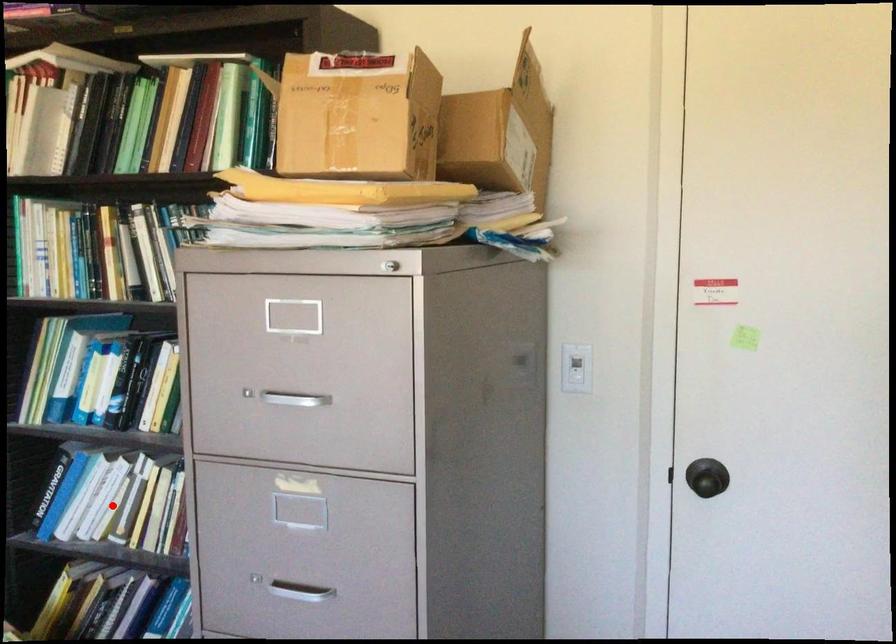
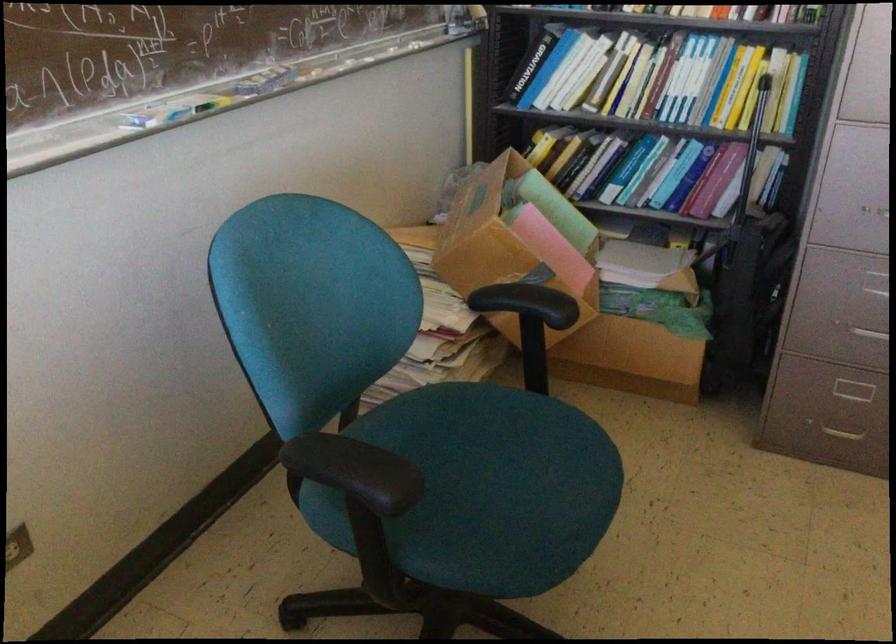
Find the pixel in the second image that matches the highlighted location in the first image.

(583, 77)